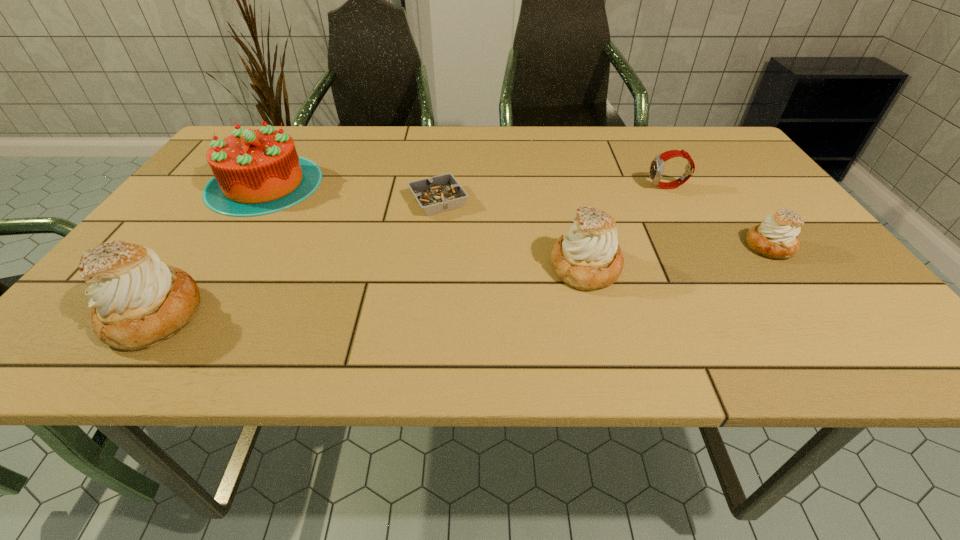
This screenshot has height=540, width=960. What are the coordinates of `the leftmost pastry` in the screenshot? It's located at (137, 301).

You are a GUI agent. You are given a task and a screenshot of the screen. Output one action in this format:
    pyautogui.click(x=<x>, y=<y>)
    Task: Click on the fourth object from left to right
    The image size is (960, 540).
    Given the screenshot: What is the action you would take?
    pyautogui.click(x=588, y=257)

Locate an element on the screen. This screenshot has width=960, height=540. the second shortest pastry is located at coordinates (588, 257).

Identify the location of the rightmost pastry. The height and width of the screenshot is (540, 960). (776, 238).

Locate an element on the screen. This screenshot has width=960, height=540. the rightmost object is located at coordinates (776, 238).

At what (x,y) coordinates should I click in order to perform the action: click on the second object from right to left. Please return your answer as a coordinate pair (x, y). This screenshot has height=540, width=960. Looking at the image, I should click on (657, 165).

Where is `cake`? cake is located at coordinates (256, 172).

I want to click on the shortest object, so click(x=441, y=193).

Locate an element on the screen. the third object from left to right is located at coordinates (441, 193).

The width and height of the screenshot is (960, 540). I want to click on blank space located 0.230m on the back of the leftmost pastry, so click(226, 213).